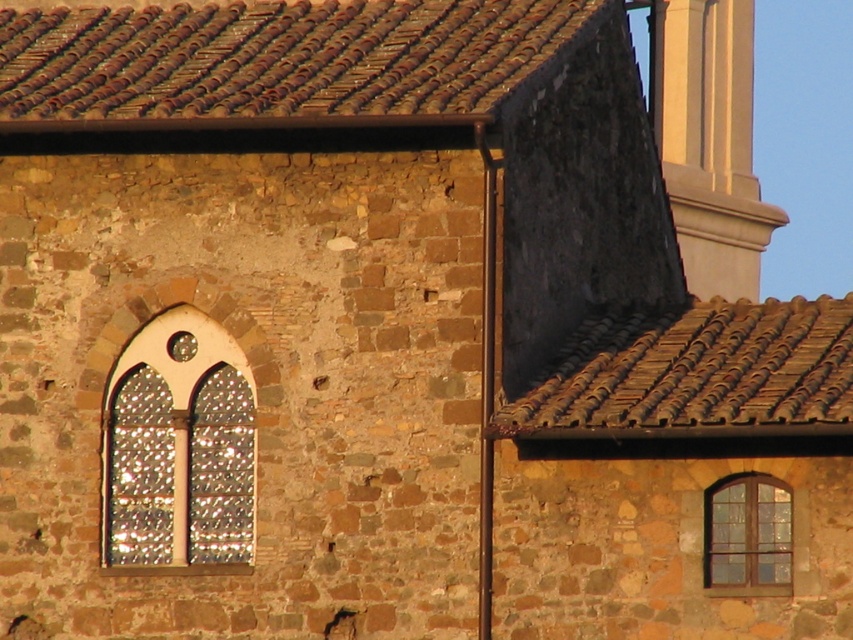
Question: Is brown clay tiles at upper left positioned before clear glass window at right?

Choices:
 (A) yes
 (B) no

Answer: (B)

Question: Where is stained glass window at left located in relation to clear glass window at right in the image?

Choices:
 (A) left
 (B) right

Answer: (A)

Question: Which point is farther to the camera?

Choices:
 (A) (218, 80)
 (B) (763, 509)
 (C) (213, 486)

Answer: (A)

Question: Estimate the real-world distances between objects in this image. Which object is closer to the brown clay tiles at upper left?

Choices:
 (A) stained glass window at left
 (B) brown tile roof at upper right

Answer: (A)

Question: Does brown clay tiles at upper left appear on the right side of clear glass window at right?

Choices:
 (A) no
 (B) yes

Answer: (A)

Question: Which point is farther to the camera?

Choices:
 (A) stained glass window at left
 (B) clear glass window at right

Answer: (A)